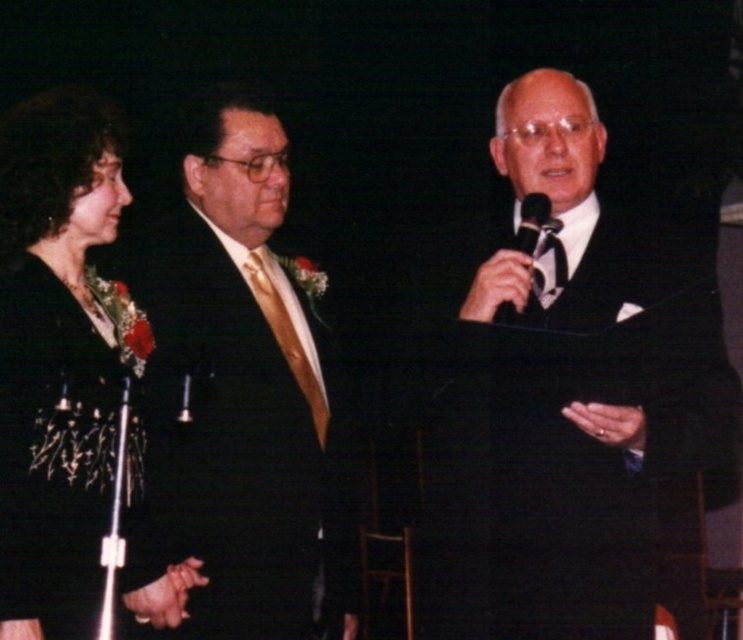
You are a photographer positioned behind the black metallic microphone at center. You need to capture a clear photo of the person wearing the black satin dress at left. Can you see their face without any obstruction?

The black satin dress at left is in front of the black metallic microphone at center, so yes, the photographer can see the face of the person wearing the black satin dress at left without obstruction as they are positioned in front.

From the picture: You are an event coordinator checking the stage setup for a formal event. You see the black silk suit at center and the black metallic microphone at center. Which object is closer to the audience seated in front of the stage?

The black silk suit at center is in front of the black metallic microphone at center, so the black silk suit at center is closer to the audience.